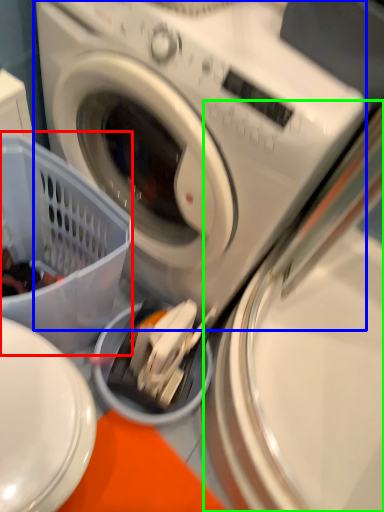
Question: Which is farther away from basket (highlighted by a red box)? washing machine (highlighted by a blue box) or washing machine (highlighted by a green box)?

Choices:
 (A) washing machine
 (B) washing machine

Answer: (B)